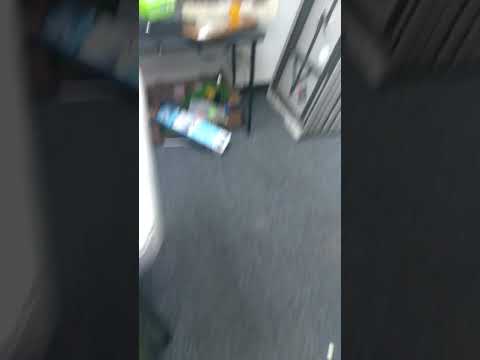
You are a GUI agent. You are given a task and a screenshot of the screen. Output one action in this format:
    pyautogui.click(x=<x>, y=<y>)
    Task: Click on the table's edge
    
    Given the screenshot: What is the action you would take?
    pyautogui.click(x=157, y=233)